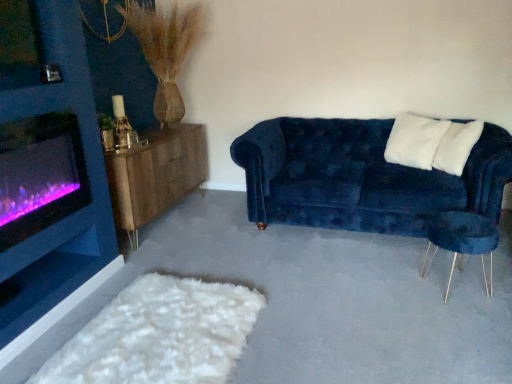
Find the location of a particular element. Image resolution: width=512 pixels, height=384 pixels. spots to the right of velvet blue armchair at right is located at coordinates (493, 275).